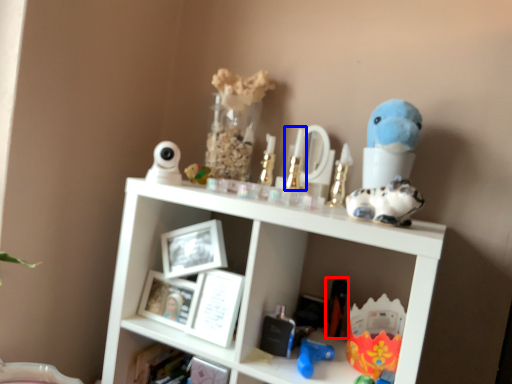
Question: Among these objects, which one is nearest to the camera, toy (highlighted by a red box) or toy (highlighted by a blue box)?

Choices:
 (A) toy
 (B) toy

Answer: (B)